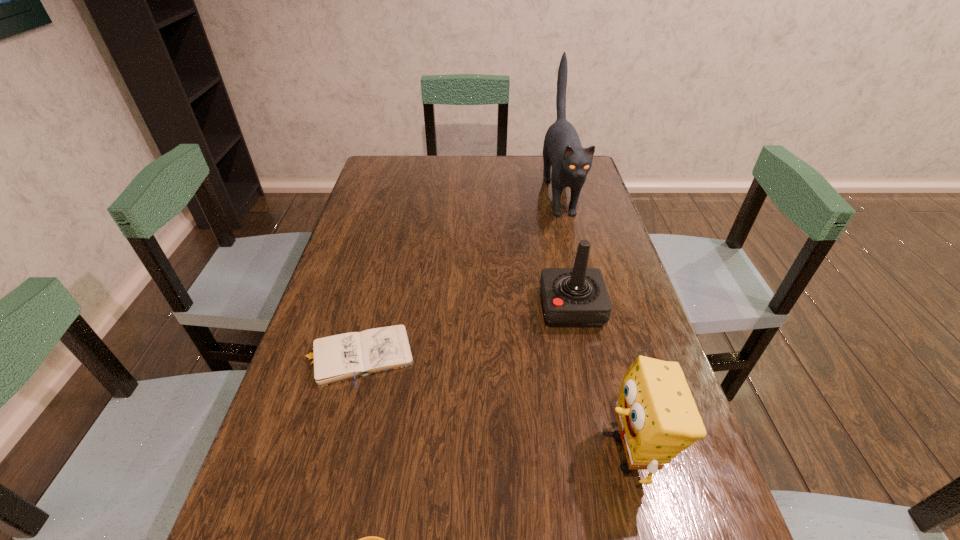
In the image, there is a desktop. Where is `vacant space at the left edge`? Image resolution: width=960 pixels, height=540 pixels. vacant space at the left edge is located at coordinates (248, 489).

Locate an element on the screen. The height and width of the screenshot is (540, 960). vacant space at the right edge of the desktop is located at coordinates (606, 217).

Identify the location of free space between the joystick and the notebook. (465, 332).

Locate an element on the screen. The height and width of the screenshot is (540, 960). unoccupied area between the shortest object and the cat is located at coordinates (458, 275).

Find the location of a particular element. The height and width of the screenshot is (540, 960). free space that is in between the joystick and the notebook is located at coordinates [x=465, y=332].

Identify the location of empty space that is in between the joystick and the notebook. The width and height of the screenshot is (960, 540). (465, 332).

This screenshot has height=540, width=960. Find the location of `unoccupied area between the farthest object and the notebook`. unoccupied area between the farthest object and the notebook is located at coordinates (458, 275).

Find the location of a particular element. The height and width of the screenshot is (540, 960). blank region between the notebook and the joystick is located at coordinates (465, 332).

Select which object appears as the closest to the joystick. Please provide its 2D coordinates. Your answer should be formatted as a tuple, i.e. [(x, y)], where the tuple contains the x and y coordinates of a point satisfying the conditions above.

[(562, 150)]

Where is `the third closest object to the tallest object`? the third closest object to the tallest object is located at coordinates (657, 417).